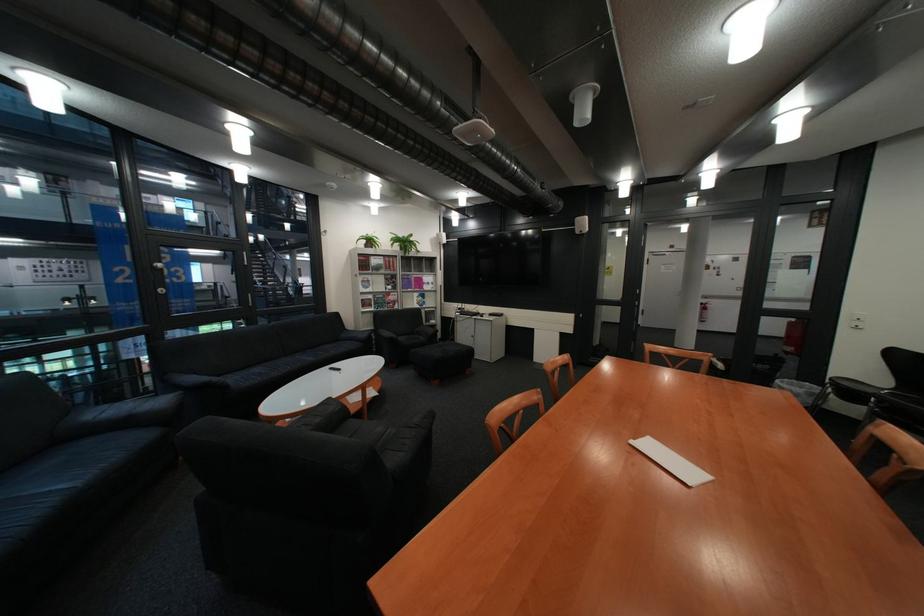
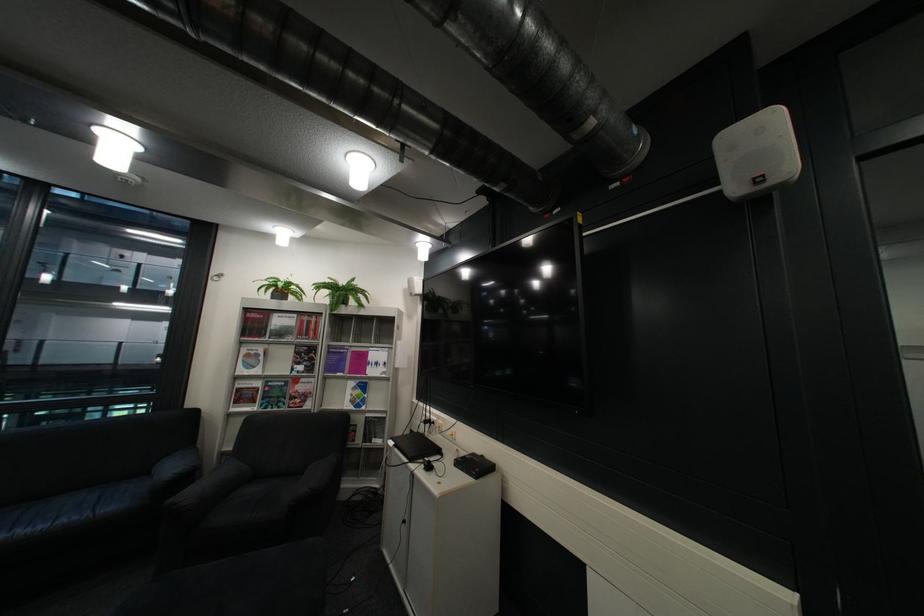
Find the pixel in the second image that matches point 395,302 in the first image.

(290, 394)